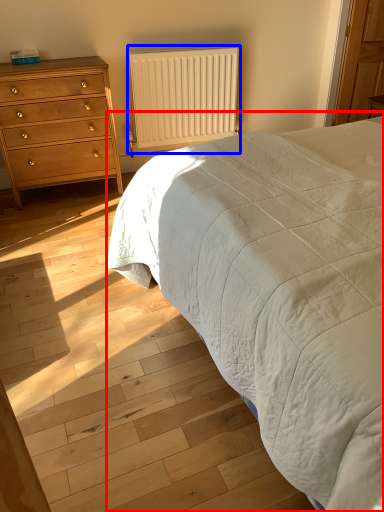
Question: Which of the following is the farthest to the observer, bed (highlighted by a red box) or radiator (highlighted by a blue box)?

Choices:
 (A) bed
 (B) radiator

Answer: (B)